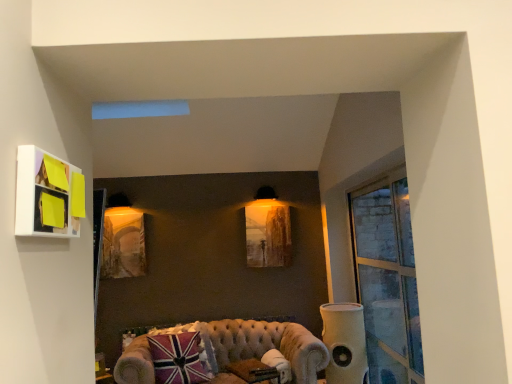
Locate an element on the screen. The height and width of the screenshot is (384, 512). matte gold picture frame at center, placed as the 3th picture frame when sorted from right to left is located at coordinates (123, 243).

What is the approximate height of velvet beige couch at lower center?

It is 27.67 inches.

Locate an element on the screen. The width and height of the screenshot is (512, 384). clear glass window at right is located at coordinates (387, 278).

From the image's perspective, would you say matte gold picture frame at center, the 2th picture frame when ordered from back to front, is shown under velvet beige couch at lower center?

Incorrect, from the image's perspective, matte gold picture frame at center, the 2th picture frame when ordered from back to front, is higher than velvet beige couch at lower center.

Could you tell me if matte gold picture frame at center, which is the 1th picture frame from left to right, is turned towards velvet beige couch at lower center?

No, matte gold picture frame at center, which is the 1th picture frame from left to right, is not turned towards velvet beige couch at lower center.

I want to click on studio couch located in front of the matte gold picture frame at center, placed as the 3th picture frame when sorted from right to left, so click(268, 345).

Is matte gold picture frame at center, which is the 1th picture frame from left to right, with matte white picture frame at upper left, the second picture frame in the right-to-left sequence?

There is a gap between matte gold picture frame at center, which is the 1th picture frame from left to right, and matte white picture frame at upper left, the second picture frame in the right-to-left sequence.

Considering the relative sizes of matte gold picture frame at center, placed as the 3th picture frame when sorted from right to left, and matte white picture frame at upper left, which ranks as the 2th picture frame in left-to-right order, in the image provided, is matte gold picture frame at center, placed as the 3th picture frame when sorted from right to left, thinner than matte white picture frame at upper left, which ranks as the 2th picture frame in left-to-right order,?

Yes.

Is matte gold picture frame at center, the 2th picture frame viewed from the front, in front of or behind matte white picture frame at upper left, acting as the first picture frame starting from the front, in the image?

In the image, matte gold picture frame at center, the 2th picture frame viewed from the front, appears behind matte white picture frame at upper left, acting as the first picture frame starting from the front.

Does matte gold picture frame at center, the 2th picture frame when ordered from back to front, appear on the right side of matte white picture frame at upper left, which is the third picture frame in back-to-front order?

No, matte gold picture frame at center, the 2th picture frame when ordered from back to front, is not to the right of matte white picture frame at upper left, which is the third picture frame in back-to-front order.

Who is more distant, velvet beige couch at lower center or white fabric speaker at right?

white fabric speaker at right is further away from the camera.

Is velvet beige couch at lower center placed right next to white fabric speaker at right?

velvet beige couch at lower center is not next to white fabric speaker at right, and they're not touching.

In the scene shown: Which of these two, velvet beige couch at lower center or white fabric speaker at right, stands shorter?

velvet beige couch at lower center.

Can you confirm if clear glass window at right is thinner than union jack fabric pillow at lower left?

Correct, the width of clear glass window at right is less than that of union jack fabric pillow at lower left.

Is union jack fabric pillow at lower left located within clear glass window at right?

Actually, union jack fabric pillow at lower left is outside clear glass window at right.

Is clear glass window at right facing towards union jack fabric pillow at lower left?

Yes, clear glass window at right is facing union jack fabric pillow at lower left.

Which is farther from the camera, (374, 196) or (185, 338)?

The point (374, 196) is more distant.

Is white fabric speaker at right not within matte wooden picture frame at center, the first picture frame viewed from the right?

Yes.

This screenshot has height=384, width=512. There is a white fabric speaker at right. In order to click on the 2nd picture frame above it (from a real-world perspective) in this screenshot , I will do `click(268, 234)`.

From a real-world perspective, which is physically above, white fabric speaker at right or matte wooden picture frame at center, the first picture frame positioned from the back?

matte wooden picture frame at center, the first picture frame positioned from the back, is physically above.

Which is more to the right, white fabric speaker at right or matte wooden picture frame at center, the first picture frame viewed from the right?

Positioned to the right is white fabric speaker at right.

Is point (373, 344) positioned before point (112, 216)?

Yes, point (373, 344) is in front of point (112, 216).

Measure the distance from clear glass window at right to matte gold picture frame at center, the 2th picture frame when ordered from back to front.

clear glass window at right and matte gold picture frame at center, the 2th picture frame when ordered from back to front, are 2.26 meters apart from each other.

Which of these two, clear glass window at right or matte gold picture frame at center, placed as the 3th picture frame when sorted from right to left, is smaller?

matte gold picture frame at center, placed as the 3th picture frame when sorted from right to left, is smaller.

Consider the image. Considering the relative sizes of clear glass window at right and matte gold picture frame at center, the 2th picture frame viewed from the front, in the image provided, is clear glass window at right shorter than matte gold picture frame at center, the 2th picture frame viewed from the front,?

In fact, clear glass window at right may be taller than matte gold picture frame at center, the 2th picture frame viewed from the front.

Relative to union jack fabric pillow at lower left, is white fabric speaker at right in front or behind?

In the image, white fabric speaker at right appears behind union jack fabric pillow at lower left.

Based on their positions, is white fabric speaker at right located to the left or right of union jack fabric pillow at lower left?

In the image, white fabric speaker at right appears on the right side of union jack fabric pillow at lower left.

Is white fabric speaker at right thinner than union jack fabric pillow at lower left?

No.

From the image's perspective, is white fabric speaker at right below union jack fabric pillow at lower left?

No, from the image's perspective, white fabric speaker at right is not beneath union jack fabric pillow at lower left.

Locate an element on the screen. The height and width of the screenshot is (384, 512). studio couch in front of the matte gold picture frame at center, the 2th picture frame when ordered from back to front is located at coordinates (268, 345).

Locate an element on the screen. The image size is (512, 384). the 2nd picture frame below the matte white picture frame at upper left, which ranks as the 2th picture frame in left-to-right order (from a real-world perspective) is located at coordinates (123, 243).

Based on their spatial positions, is matte gold picture frame at center, placed as the 3th picture frame when sorted from right to left, or white fabric speaker at right closer to matte white picture frame at upper left, which ranks as the 2th picture frame in left-to-right order?

white fabric speaker at right is positioned closer to the anchor matte white picture frame at upper left, which ranks as the 2th picture frame in left-to-right order.

Based on their spatial positions, is clear glass window at right or velvet beige couch at lower center closer to matte wooden picture frame at center, the first picture frame viewed from the right?

Based on the image, velvet beige couch at lower center appears to be nearer to matte wooden picture frame at center, the first picture frame viewed from the right.

Based on their spatial positions, is velvet beige couch at lower center or matte white picture frame at upper left, the second picture frame in the right-to-left sequence, further from white fabric speaker at right?

The object further to white fabric speaker at right is matte white picture frame at upper left, the second picture frame in the right-to-left sequence.

Which object lies further to the anchor point union jack fabric pillow at lower left, matte gold picture frame at center, which is the 1th picture frame from left to right, or velvet beige couch at lower center?

matte gold picture frame at center, which is the 1th picture frame from left to right, is positioned further to the anchor union jack fabric pillow at lower left.

When comparing their distances from clear glass window at right, does matte gold picture frame at center, the 2th picture frame when ordered from back to front, or matte white picture frame at upper left, acting as the first picture frame starting from the front, seem closer?

Based on the image, matte gold picture frame at center, the 2th picture frame when ordered from back to front, appears to be nearer to clear glass window at right.

Which object lies further to the anchor point union jack fabric pillow at lower left, velvet beige couch at lower center or matte gold picture frame at center, which is the 1th picture frame from left to right?

matte gold picture frame at center, which is the 1th picture frame from left to right, is positioned further to the anchor union jack fabric pillow at lower left.

Considering their positions, is matte white picture frame at upper left, which is the third picture frame in back-to-front order, positioned further to union jack fabric pillow at lower left than matte wooden picture frame at center, the first picture frame viewed from the right?

matte white picture frame at upper left, which is the third picture frame in back-to-front order, is further to union jack fabric pillow at lower left.

When comparing their distances from white fabric speaker at right, does velvet beige couch at lower center or clear glass window at right seem further?

clear glass window at right is positioned further to the anchor white fabric speaker at right.

Where is `window located between matte white picture frame at upper left, the second picture frame in the right-to-left sequence, and velvet beige couch at lower center in the depth direction`? window located between matte white picture frame at upper left, the second picture frame in the right-to-left sequence, and velvet beige couch at lower center in the depth direction is located at coordinates (387, 278).

Image resolution: width=512 pixels, height=384 pixels. Find the location of `studio couch located between matte white picture frame at upper left, the second picture frame in the right-to-left sequence, and matte wooden picture frame at center, the first picture frame viewed from the right, in the depth direction`. studio couch located between matte white picture frame at upper left, the second picture frame in the right-to-left sequence, and matte wooden picture frame at center, the first picture frame viewed from the right, in the depth direction is located at coordinates (268, 345).

You are a GUI agent. You are given a task and a screenshot of the screen. Output one action in this format:
    pyautogui.click(x=<x>, y=<y>)
    Task: Click on the window positioned between matte white picture frame at upper left, which is the third picture frame in back-to-front order, and matte gold picture frame at center, the 2th picture frame when ordered from back to front, from near to far
    The image size is (512, 384).
    Given the screenshot: What is the action you would take?
    pyautogui.click(x=387, y=278)

You are a GUI agent. You are given a task and a screenshot of the screen. Output one action in this format:
    pyautogui.click(x=<x>, y=<y>)
    Task: Click on the window located between matte white picture frame at upper left, which ranks as the 2th picture frame in left-to-right order, and matte wooden picture frame at center, the first picture frame positioned from the back, in the depth direction
    This screenshot has width=512, height=384.
    Given the screenshot: What is the action you would take?
    pyautogui.click(x=387, y=278)